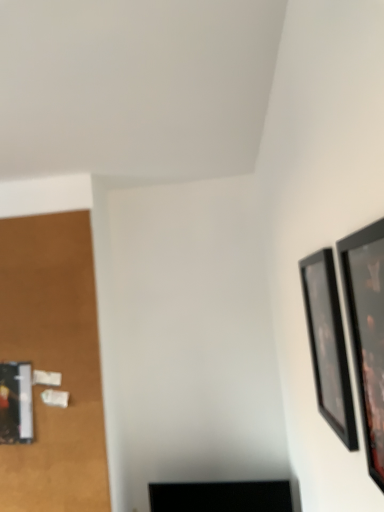
Question: Looking at their shapes, would you say black glossy picture frame at right, which is the first picture frame from back to front, is wider or thinner than black glossy tv at lower center?

Choices:
 (A) thin
 (B) wide

Answer: (A)

Question: Is point (326, 419) closer or farther from the camera than point (249, 496)?

Choices:
 (A) farther
 (B) closer

Answer: (B)

Question: Considering the real-world distances, which object is closest to the black glossy tv at lower center?

Choices:
 (A) black glossy picture frame at upper right, arranged as the 2th picture frame when viewed from the back
 (B) black glossy picture frame at right, which is the first picture frame from back to front

Answer: (B)

Question: Which is nearer to the black glossy tv at lower center?

Choices:
 (A) black glossy picture frame at upper right, which ranks as the first picture frame in front-to-back order
 (B) black glossy picture frame at right, which is the first picture frame from back to front

Answer: (B)